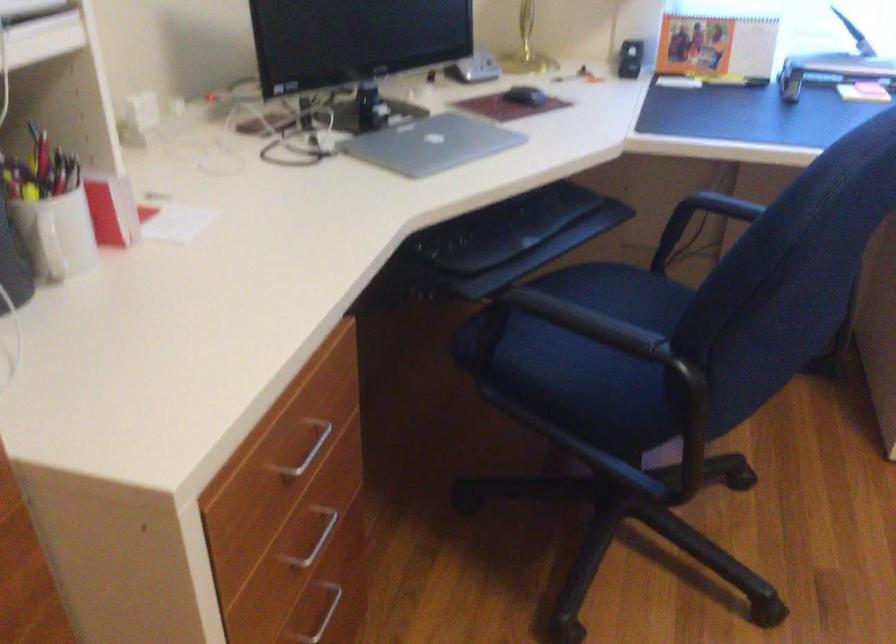
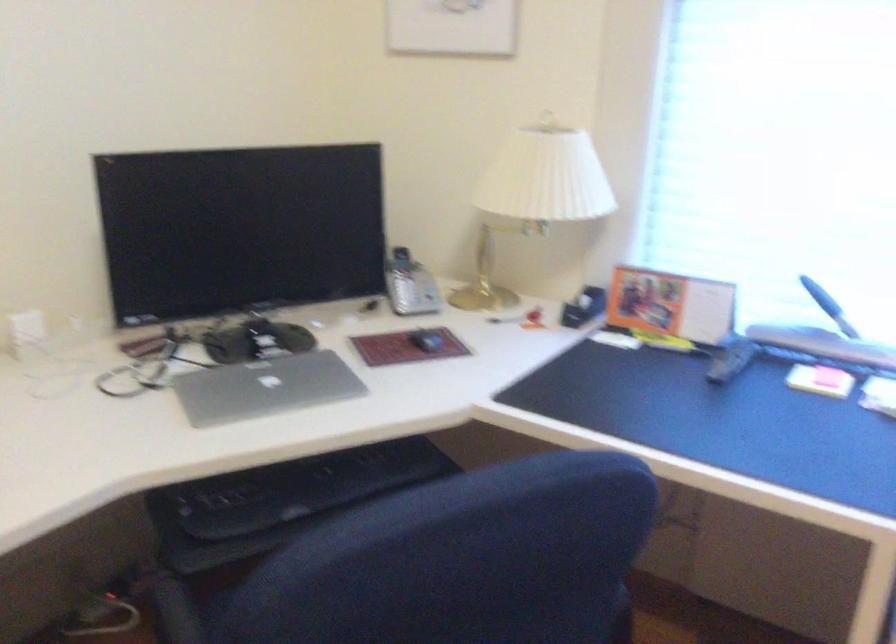
In the second image, find the point that corresponds to the point at 531,96 in the first image.

(426, 341)